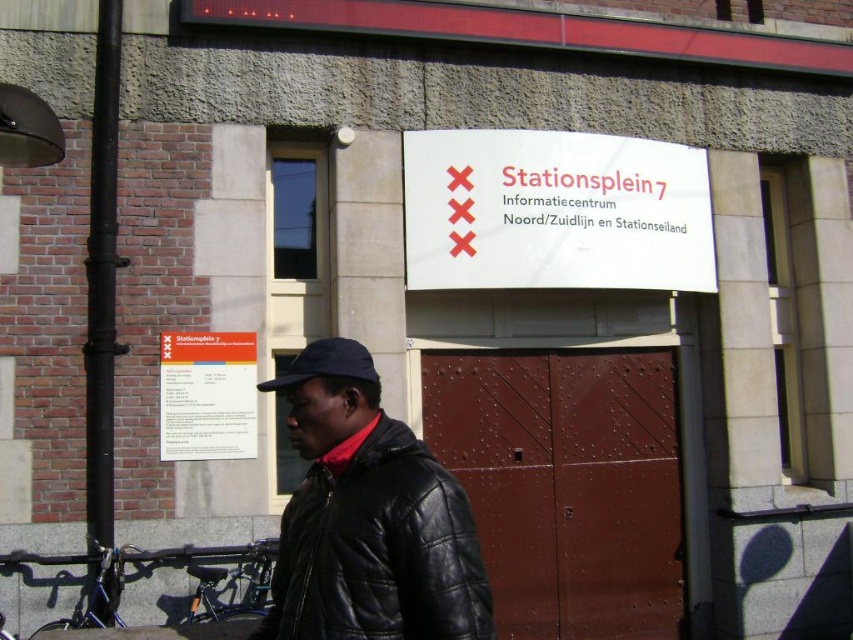
Does black leather jacket at lower left appear over matte blue cap at center?

No, black leather jacket at lower left is not above matte blue cap at center.

The width and height of the screenshot is (853, 640). What do you see at coordinates (379, 550) in the screenshot?
I see `black leather jacket at lower left` at bounding box center [379, 550].

The image size is (853, 640). What are the coordinates of `black leather jacket at lower left` in the screenshot? It's located at (379, 550).

From the picture: Is white paper sign at center shorter than white paper sign at upper center?

No.

Does point (612, 189) lie in front of point (209, 342)?

No, (612, 189) is behind (209, 342).

The height and width of the screenshot is (640, 853). In order to click on white paper sign at center in this screenshot , I will do `click(554, 211)`.

Who is positioned more to the left, white paper sign at center or matte blue cap at center?

matte blue cap at center is more to the left.

Is point (651, 214) farther from viewer compared to point (309, 356)?

Yes, point (651, 214) is behind point (309, 356).

Is point (492, 221) positioned in front of point (280, 371)?

No, it is behind (280, 371).

Image resolution: width=853 pixels, height=640 pixels. Identify the location of white paper sign at center. (554, 211).